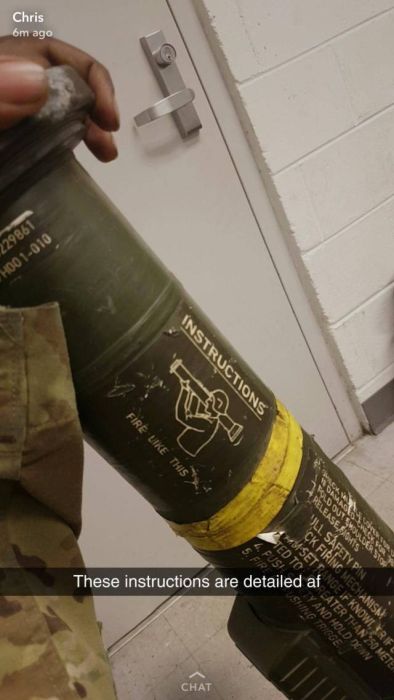
I want to click on wall, so click(355, 267), click(331, 141).